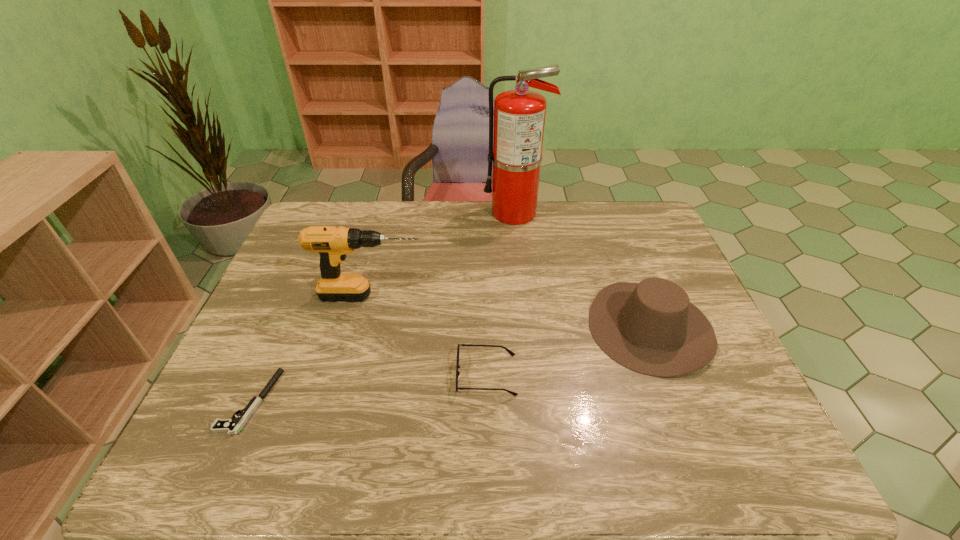
Where is `fire extinguisher`? The width and height of the screenshot is (960, 540). fire extinguisher is located at coordinates (519, 115).

Where is `the tallest object`? This screenshot has width=960, height=540. the tallest object is located at coordinates (519, 115).

I want to click on the second tallest object, so click(x=332, y=243).

In order to click on drill in this screenshot , I will do `click(332, 243)`.

This screenshot has width=960, height=540. I want to click on cowboy hat, so click(x=651, y=328).

The height and width of the screenshot is (540, 960). Identify the location of the third shortest object. (651, 328).

This screenshot has height=540, width=960. In order to click on the second shortest object in this screenshot , I will do `click(511, 353)`.

Image resolution: width=960 pixels, height=540 pixels. I want to click on the leftmost object, so click(232, 426).

Where is `pistol`? The height and width of the screenshot is (540, 960). pistol is located at coordinates (232, 426).

Where is `vacant space positioned 0.220m at the nozzle of the tallest object`? This screenshot has height=540, width=960. vacant space positioned 0.220m at the nozzle of the tallest object is located at coordinates (420, 213).